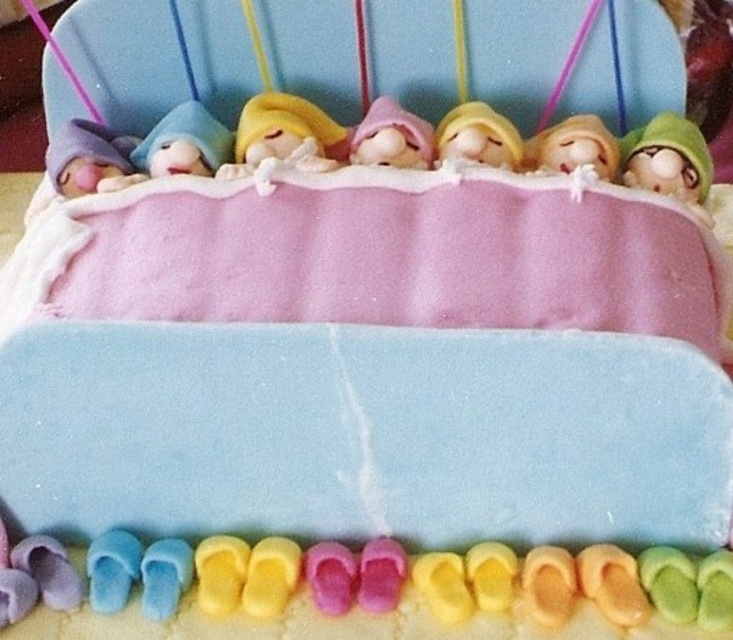
Question: Among these objects, which one is farthest from the camera?

Choices:
 (A) matte blue plush toy at center
 (B) matte pink doll at center
 (C) matte purple doll at left
 (D) pink fondant baby at center

Answer: (A)

Question: Is matte pink doll at center wider than matte yellow doll at center?

Choices:
 (A) no
 (B) yes

Answer: (B)

Question: Where is pink fondant baby at center located in relation to matte yellow doll at center in the image?

Choices:
 (A) above
 (B) below

Answer: (A)

Question: Based on their relative distances, which object is farther from the matte purple doll at left?

Choices:
 (A) yellow felt baby at center
 (B) matte blue plush toy at center
 (C) matte pink doll at center

Answer: (C)

Question: Which object appears farthest from the camera in this image?

Choices:
 (A) yellow felt baby at center
 (B) matte blue plush toy at center

Answer: (B)

Question: Is green matte toy at right behind yellow felt baby at center?

Choices:
 (A) yes
 (B) no

Answer: (B)